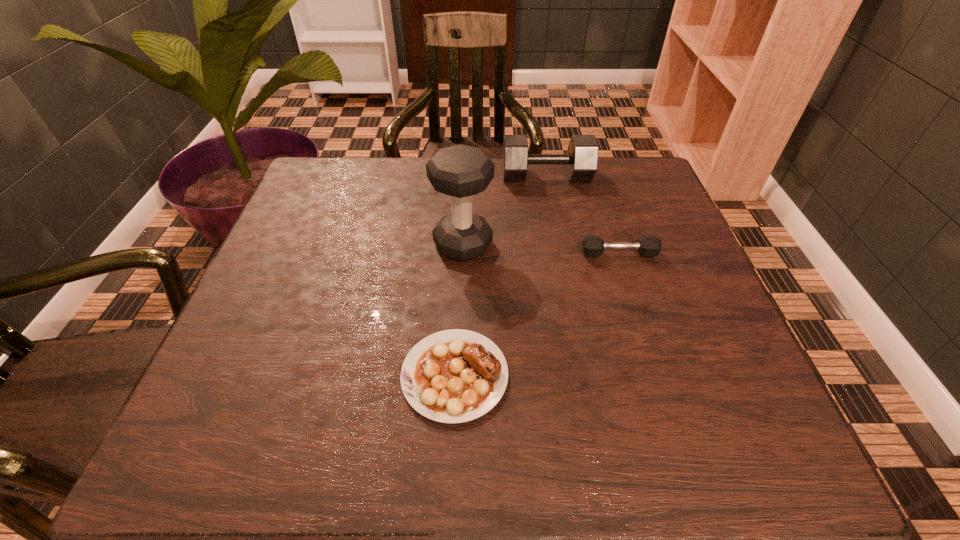
Locate an element on the screen. The height and width of the screenshot is (540, 960). the tallest object is located at coordinates (460, 171).

The height and width of the screenshot is (540, 960). What are the coordinates of `the tallest dumbbell` in the screenshot? It's located at (460, 171).

Where is `the second shortest dumbbell`? The height and width of the screenshot is (540, 960). the second shortest dumbbell is located at coordinates (582, 154).

Image resolution: width=960 pixels, height=540 pixels. What are the coordinates of `the farthest dumbbell` in the screenshot? It's located at (582, 154).

Identify the location of the third tallest object. (592, 246).

Locate an element on the screen. the shortest object is located at coordinates (452, 376).

The width and height of the screenshot is (960, 540). Find the location of `steak`. steak is located at coordinates 452,376.

At what (x,y) coordinates should I click in order to perform the action: click on vacant space located 0.140m on the front of the leftmost dumbbell. Please return your answer as a coordinate pair (x, y). Looking at the image, I should click on (460, 316).

You are a GUI agent. You are given a task and a screenshot of the screen. Output one action in this format:
    pyautogui.click(x=<x>, y=<y>)
    Task: Click on the free space located 0.090m on the left of the second shortest dumbbell
    This screenshot has height=540, width=960.
    Given the screenshot: What is the action you would take?
    pyautogui.click(x=469, y=176)

Locate an element on the screen. This screenshot has height=540, width=960. free space located on the front of the third tallest object is located at coordinates click(633, 299).